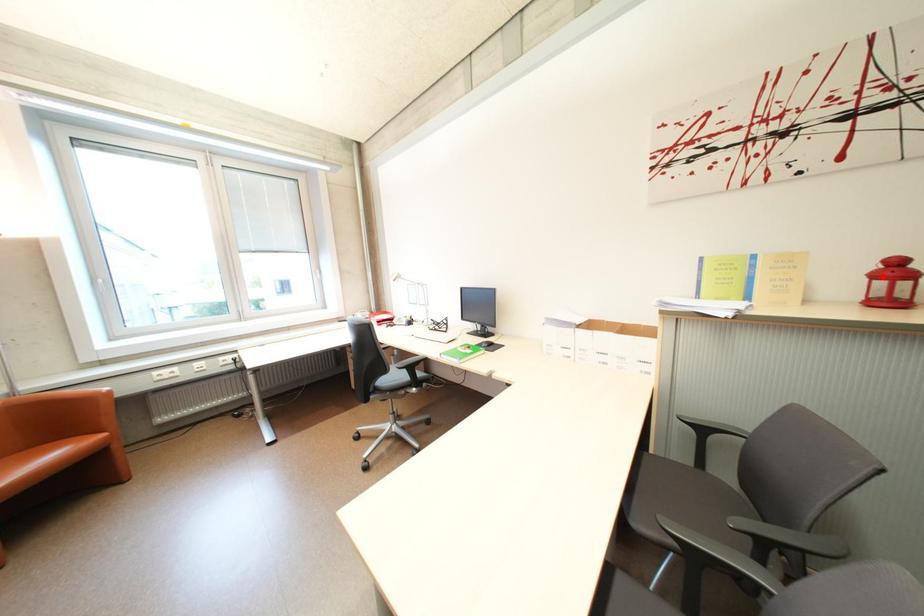
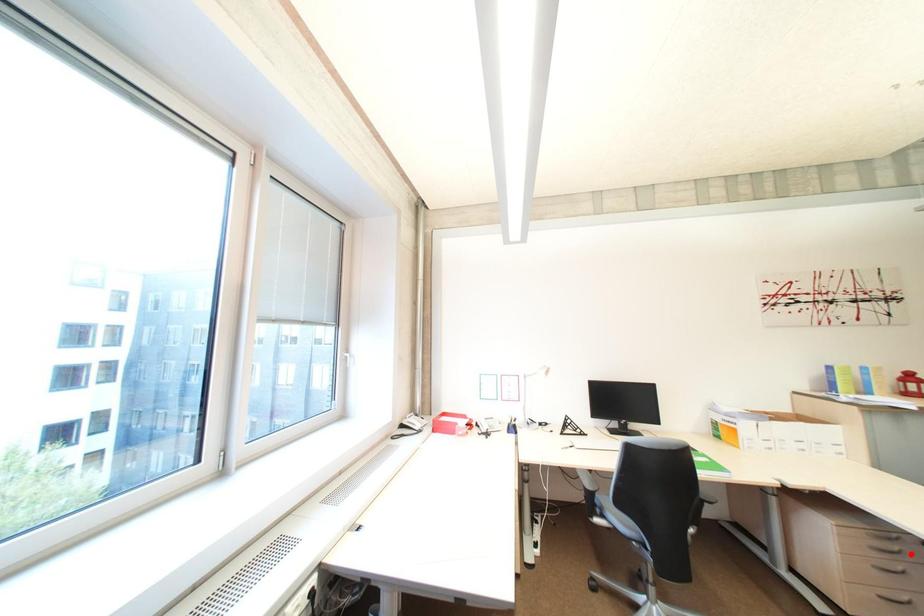
I am providing you with two images of the same scene from different viewpoints. A red point is marked on the first image and another point is marked on the second image. Does the point marked in image1 correspond to the same location as the one in image2?

No